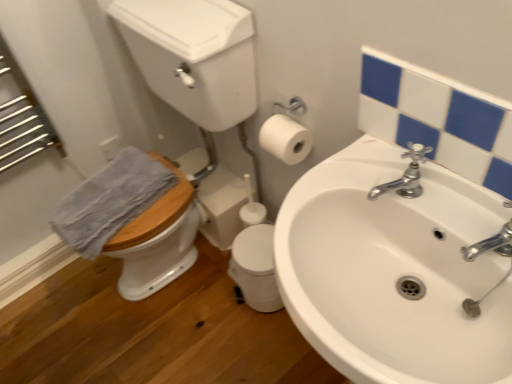
This screenshot has height=384, width=512. Identify the location of free location in front of wooden at left. (190, 343).